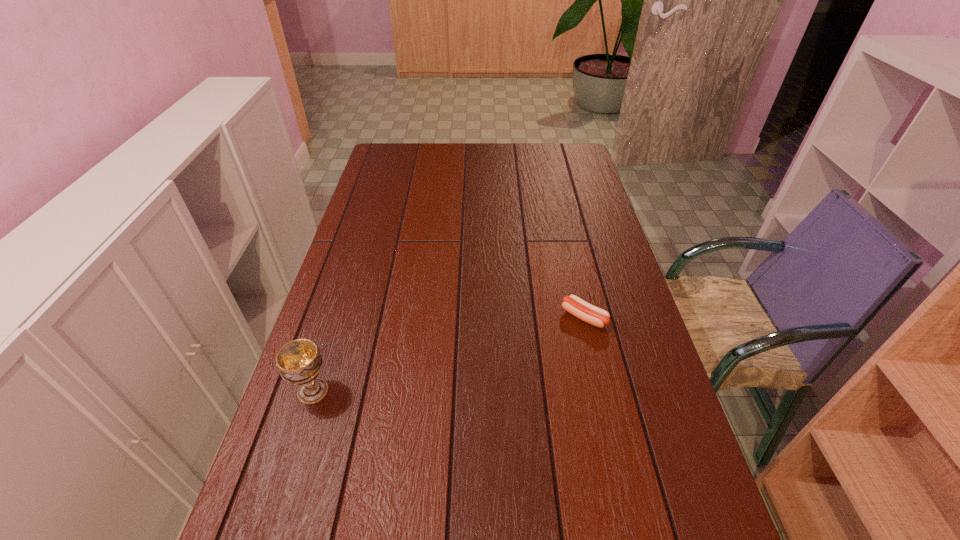
You are a GUI agent. You are given a task and a screenshot of the screen. Output one action in this format:
    pyautogui.click(x=<x>, y=<y>)
    Task: Click on the nearer object
    Image resolution: width=960 pixels, height=540 pixels.
    Given the screenshot: What is the action you would take?
    pyautogui.click(x=299, y=362)

Find the location of `the taller object`. the taller object is located at coordinates [299, 362].

The image size is (960, 540). Find the location of `the right object`. the right object is located at coordinates (579, 308).

Identify the location of sausage. The height and width of the screenshot is (540, 960). (579, 308).

Identify the location of vacant space situated on the front of the nearer object. The image size is (960, 540). 266,539.

Image resolution: width=960 pixels, height=540 pixels. I want to click on vacant space located 0.090m on the back of the farther object, so click(x=575, y=280).

Where is `object present at the left edge`? Image resolution: width=960 pixels, height=540 pixels. object present at the left edge is located at coordinates (299, 362).

Identify the location of object situated at the right edge. This screenshot has height=540, width=960. (579, 308).

Image resolution: width=960 pixels, height=540 pixels. What are the coordinates of `vacant region at the far edge of the desktop` in the screenshot? It's located at (430, 156).

Where is `vacant space at the left edge of the desktop`? vacant space at the left edge of the desktop is located at coordinates (371, 298).